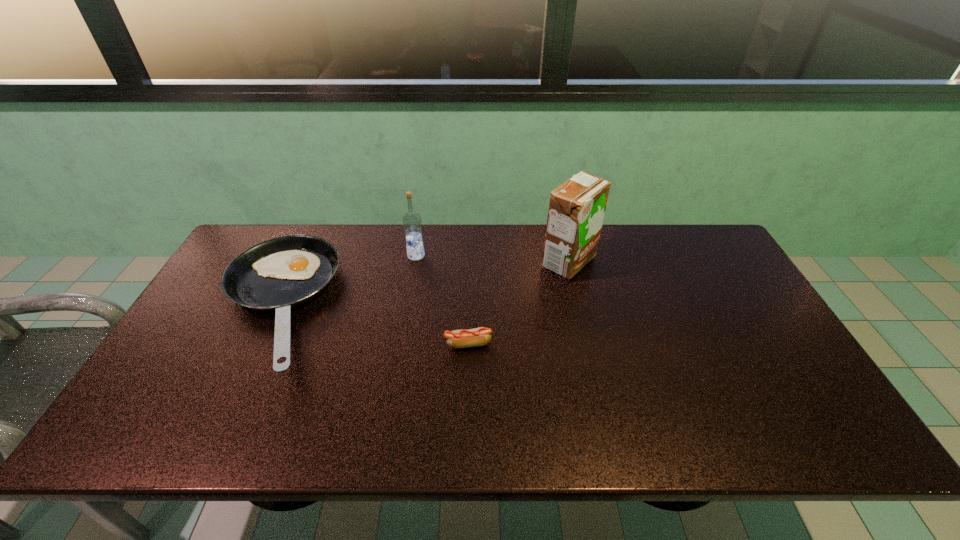
You are a GUI agent. You are given a task and a screenshot of the screen. Output one action in this format:
    pyautogui.click(x=<x>, y=<y>)
    Task: Click on the free space at the near edge of the desktop
    The height and width of the screenshot is (540, 960).
    Given the screenshot: What is the action you would take?
    pyautogui.click(x=366, y=426)

You are a GUI agent. You are given a task and a screenshot of the screen. Output one action in this format:
    pyautogui.click(x=<x>, y=<y>)
    Task: Click on the vacant space at the left edge of the desktop
    
    Given the screenshot: What is the action you would take?
    pyautogui.click(x=239, y=325)

The width and height of the screenshot is (960, 540). Find the location of `vacant space at the right edge`. vacant space at the right edge is located at coordinates click(x=715, y=293).

Locate an element on the screen. The image size is (960, 540). vacant space that's between the sausage and the leftmost object is located at coordinates (372, 325).

Where is `free space between the second object from right to left and the leftmost object`? The height and width of the screenshot is (540, 960). free space between the second object from right to left and the leftmost object is located at coordinates (372, 325).

This screenshot has width=960, height=540. What are the coordinates of `unoccupied position between the tallest object and the shortest object` in the screenshot? It's located at (518, 303).

Image resolution: width=960 pixels, height=540 pixels. In order to click on blank region between the third shortest object and the second object from right to left in this screenshot , I will do `click(443, 300)`.

I want to click on unoccupied position between the shortest object and the vodka, so pyautogui.click(x=443, y=300).

The image size is (960, 540). I want to click on empty space that is in between the carton and the leftmost object, so pos(421,285).

You are a GUI agent. You are given a task and a screenshot of the screen. Output one action in this format:
    pyautogui.click(x=<x>, y=<y>)
    Task: Click on the vacant space in between the third object from right to left and the sausage
    Image resolution: width=960 pixels, height=540 pixels.
    Given the screenshot: What is the action you would take?
    pyautogui.click(x=443, y=300)